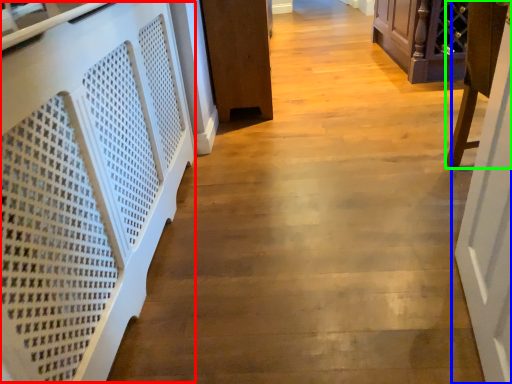
Question: Which object is positioned farthest from stairwell (highlighted by a red box)? Select from door (highlighted by a blue box) and furniture (highlighted by a green box).

Choices:
 (A) door
 (B) furniture

Answer: (B)